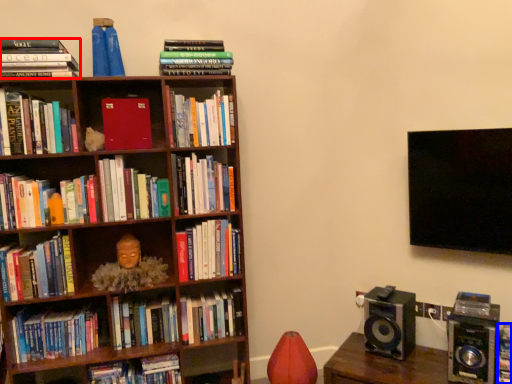
Question: Which of the following is the farthest to the observer, book (highlighted by a red box) or book (highlighted by a blue box)?

Choices:
 (A) book
 (B) book

Answer: (A)